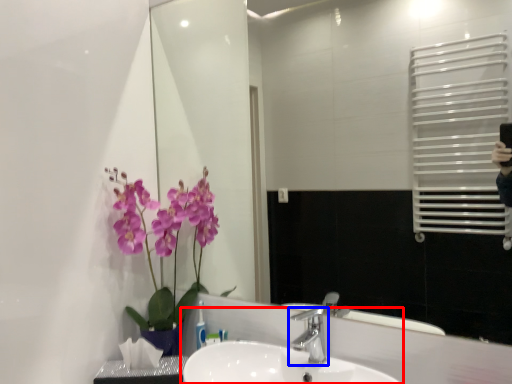
Question: Among these objects, which one is nearest to the camera, sink (highlighted by a red box) or tap (highlighted by a blue box)?

Choices:
 (A) sink
 (B) tap

Answer: (A)